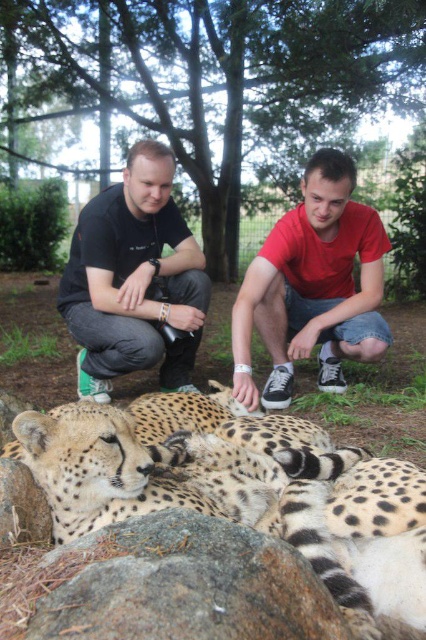
Question: Among these points, which one is nearest to the camera?

Choices:
 (A) (252, 324)
 (B) (135, 358)
 (C) (385, 604)
 (D) (253, 541)

Answer: (D)

Question: Estimate the real-world distances between objects in this image. Which object is closer to the red matte shirt at center?

Choices:
 (A) black matte shirt at center
 (B) gray rough rock at lower center

Answer: (A)

Question: Can you confirm if spotted fur cheetah at center is positioned to the left of red matte shirt at center?

Choices:
 (A) yes
 (B) no

Answer: (A)

Question: Can you confirm if black matte shirt at center is positioned to the right of red matte shirt at center?

Choices:
 (A) yes
 (B) no

Answer: (B)

Question: Which is nearer to the spotted fur cheetah at center?

Choices:
 (A) black matte shirt at center
 (B) gray rough rock at lower center
 (C) red matte shirt at center

Answer: (B)

Question: Is spotted fur cheetah at center thinner than black matte shirt at center?

Choices:
 (A) yes
 (B) no

Answer: (B)